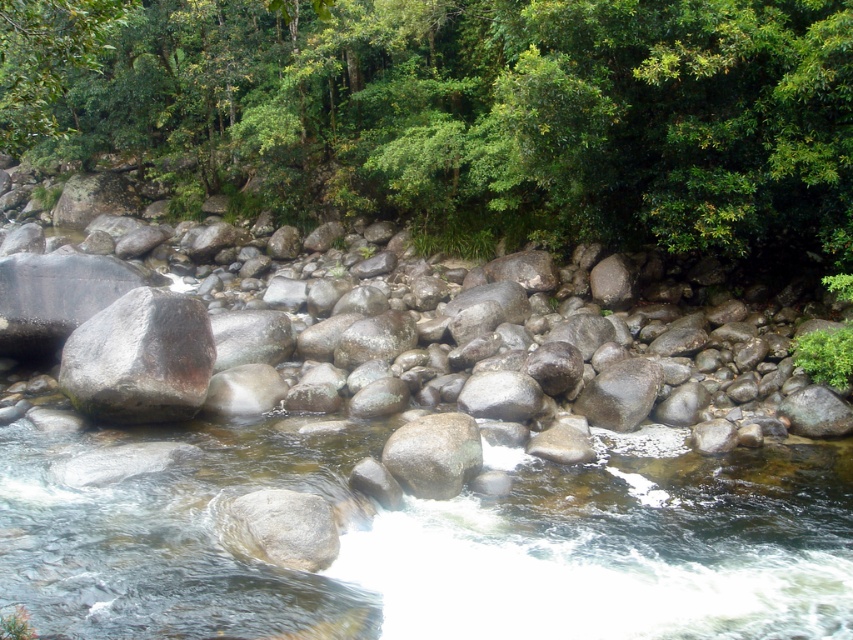
You are standing at the edge of the river and want to reach the gray smooth rock at center without getting your shoes wet. The green leafy tree at upper center is in your path. Can you walk around the tree to reach the rock?

The green leafy tree at upper center is closer to the viewer than the gray smooth rock at center, so you can walk around the tree to reach the rock since it is in front of you and the rock is further away.

You are standing on the riverbank and see two rocks in the center of the riverbed. The gray rough rock at center and the gray smooth rock at center. Which one is located to the right when looking from the riverbank?

The gray rough rock at center is positioned on the right side of the gray smooth rock at center, so when looking from the riverbank, the gray rough rock at center is to the right of the gray smooth rock at center.